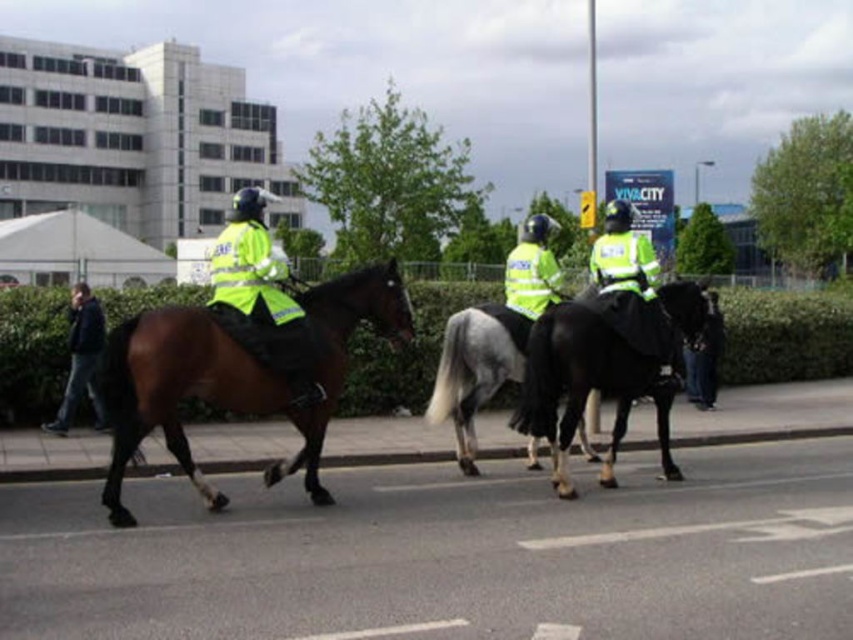
Can you confirm if gray glossy horse at center is taller than dark blue leather jacket at left?

In fact, gray glossy horse at center may be shorter than dark blue leather jacket at left.

Who is positioned more to the right, gray glossy horse at center or dark blue leather jacket at left?

Positioned to the right is gray glossy horse at center.

Does point (498, 314) come behind point (91, 344)?

No, it is in front of (91, 344).

The width and height of the screenshot is (853, 640). Find the location of `gray glossy horse at center`. gray glossy horse at center is located at coordinates (474, 369).

Is brown glossy horse at center closer to camera compared to gray glossy horse at center?

Yes, it is in front of gray glossy horse at center.

This screenshot has width=853, height=640. What do you see at coordinates (235, 376) in the screenshot? I see `brown glossy horse at center` at bounding box center [235, 376].

The width and height of the screenshot is (853, 640). Find the location of `brown glossy horse at center`. brown glossy horse at center is located at coordinates (235, 376).

Can you confirm if brown glossy horse at center is shorter than black glossy horse at right?

No, brown glossy horse at center is not shorter than black glossy horse at right.

Who is more forward, (322,326) or (670,307)?

Point (322,326) is in front.

Does point (155, 316) come in front of point (555, 438)?

Yes.

I want to click on brown glossy horse at center, so click(235, 376).